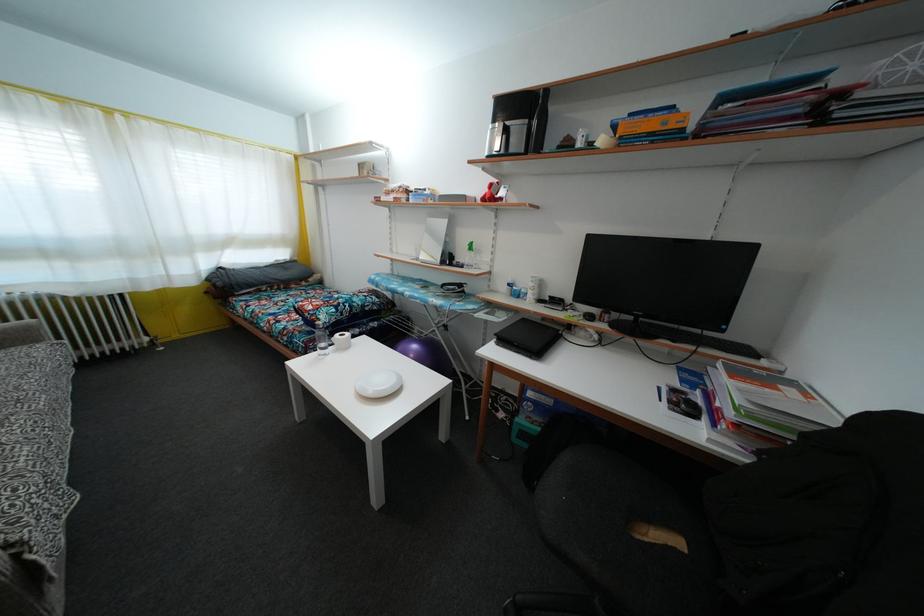
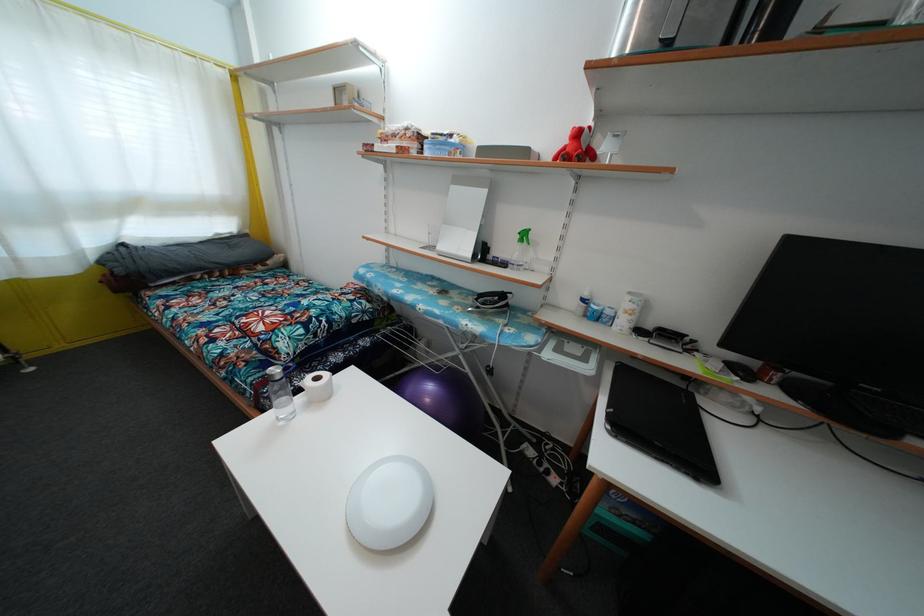
In the scene shown: Which direction would the cameraman need to move to produce the second image?

The cameraman walked toward left, forward.